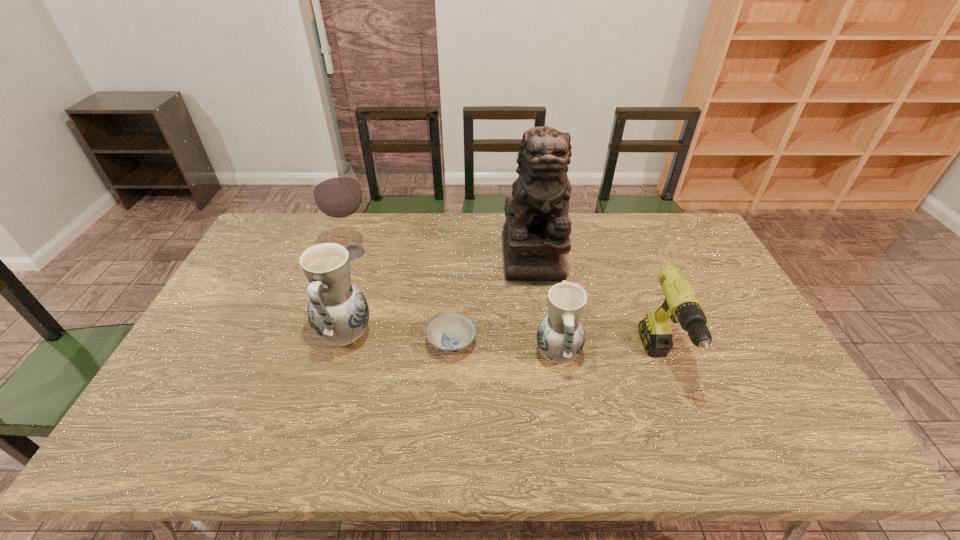
I want to click on blank area in the image that satisfies the following two spatial constraints: 1. on either side of the bowl; 2. on the left side of the taller pottery, so click(344, 343).